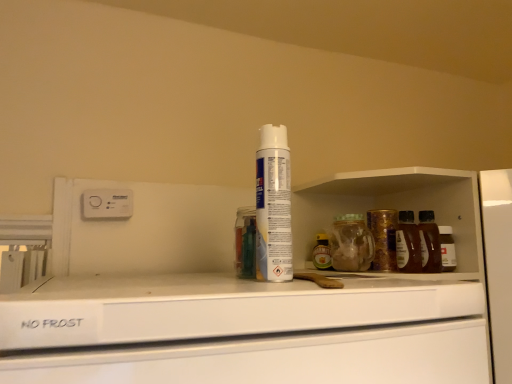
Question: Considering the positions of white plastic electric outlet at upper left and white matte shaving cream at center in the image, is white plastic electric outlet at upper left bigger or smaller than white matte shaving cream at center?

Choices:
 (A) big
 (B) small

Answer: (B)

Question: Considering the positions of white plastic electric outlet at upper left and white matte shaving cream at center in the image, is white plastic electric outlet at upper left taller or shorter than white matte shaving cream at center?

Choices:
 (A) short
 (B) tall

Answer: (A)

Question: Is white plastic electric outlet at upper left in front of or behind white matte shaving cream at center in the image?

Choices:
 (A) behind
 (B) front

Answer: (A)

Question: Is white matte shaving cream at center in front of or behind white plastic electric outlet at upper left in the image?

Choices:
 (A) front
 (B) behind

Answer: (A)

Question: Is point (280, 193) closer or farther from the camera than point (115, 213)?

Choices:
 (A) closer
 (B) farther

Answer: (A)

Question: Choose the correct answer: Is white matte shaving cream at center inside white plastic electric outlet at upper left or outside it?

Choices:
 (A) outside
 (B) inside

Answer: (A)

Question: Visually, is white matte shaving cream at center positioned to the left or to the right of white plastic electric outlet at upper left?

Choices:
 (A) right
 (B) left

Answer: (A)